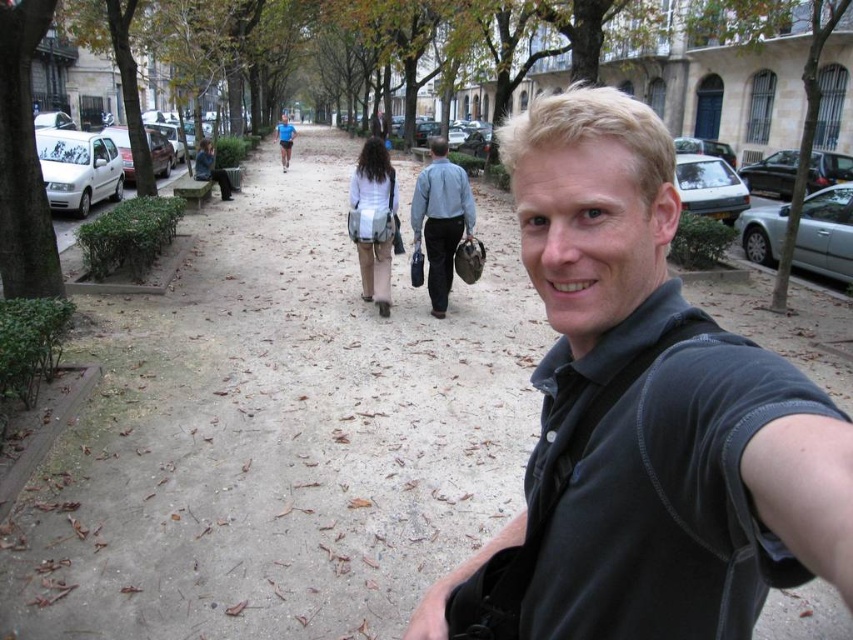
Question: Estimate the real-world distances between objects in this image. Which object is closer to the black matte shirt at center?

Choices:
 (A) light blue shirt at center
 (B) blue shirt at center

Answer: (A)

Question: Is black matte shirt at center positioned at the back of light blue shirt at center?

Choices:
 (A) no
 (B) yes

Answer: (A)

Question: Which of the following is the farthest from the observer?

Choices:
 (A) black matte shirt at center
 (B) blue shirt at center

Answer: (B)

Question: Can you confirm if black matte shirt at center is bigger than light blue shirt at center?

Choices:
 (A) no
 (B) yes

Answer: (A)

Question: Based on their relative distances, which object is nearer to the blue shirt at center?

Choices:
 (A) black matte shirt at center
 (B) light blue shirt at center

Answer: (B)

Question: Is black matte shirt at center in front of blue shirt at center?

Choices:
 (A) no
 (B) yes

Answer: (B)